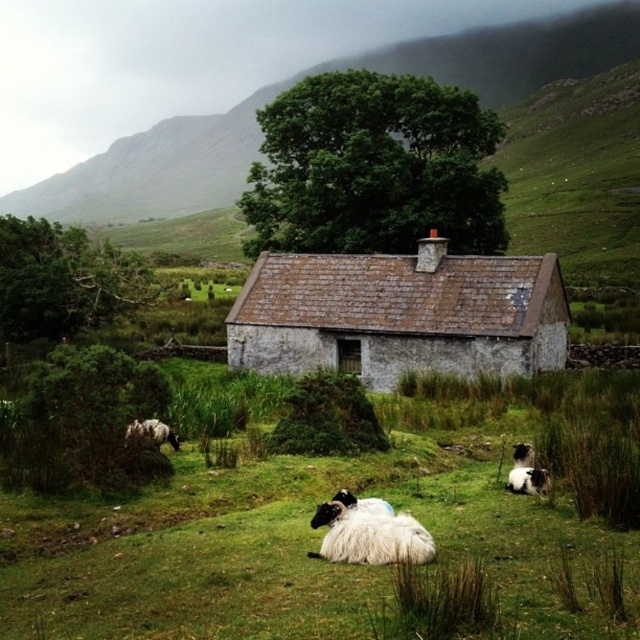
Question: Is white woolly sheep at center thinner than black woolly sheep at lower right?

Choices:
 (A) yes
 (B) no

Answer: (B)

Question: Is white woolly sheep at center below black woolly sheep at lower right?

Choices:
 (A) no
 (B) yes

Answer: (B)

Question: Estimate the real-world distances between objects in this image. Which object is farther from the white woolly sheep at lower left?

Choices:
 (A) white woolly sheep at center
 (B) black woolly sheep at lower right

Answer: (B)

Question: Which point is closer to the camera?

Choices:
 (A) (428, 307)
 (B) (128, 426)
 (C) (532, 483)

Answer: (C)

Question: Which object is farther from the camera taking this photo?

Choices:
 (A) white woolly sheep at lower left
 (B) rustic stone barn at center
 (C) white woolly sheep at center

Answer: (B)

Question: Is rustic stone barn at center above white woolly sheep at center?

Choices:
 (A) no
 (B) yes

Answer: (B)